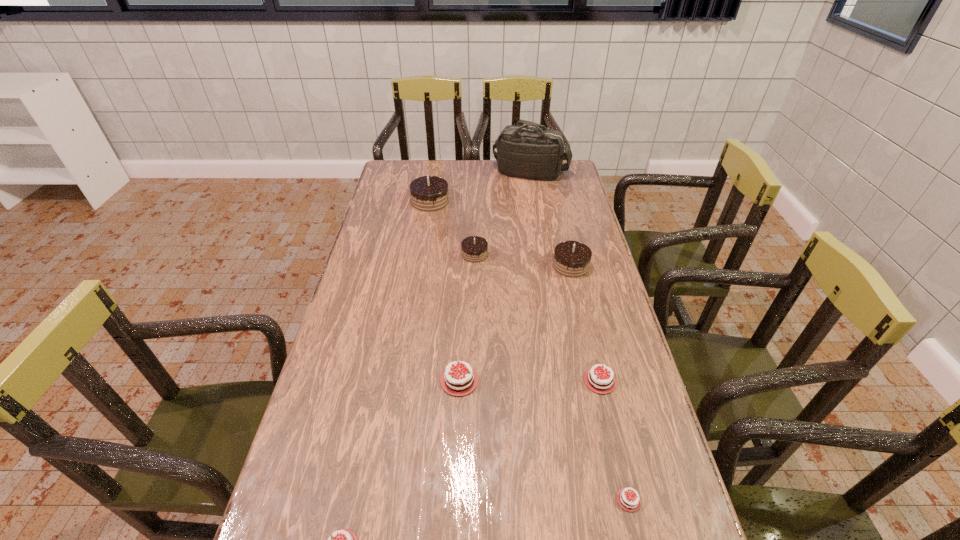
Where is `chocolate chocolate cake that is the nearest to the tallest chocolate cake`? This screenshot has height=540, width=960. chocolate chocolate cake that is the nearest to the tallest chocolate cake is located at coordinates (474, 248).

Locate an element on the screen. The image size is (960, 540). red chocolate cake that can be found as the second closest to the fifth shortest chocolate cake is located at coordinates (602, 382).

Choose which red chocolate cake is the second nearest neighbor to the second shortest object. Please provide its 2D coordinates. Your answer should be formatted as a tuple, i.e. [(x, y)], where the tuple contains the x and y coordinates of a point satisfying the conditions above.

[(628, 500)]

Locate an element on the screen. free location that satisfies the following two spatial constraints: 1. on the front side of the second tallest object; 2. on the left side of the second biggest chocolate chocolate cake is located at coordinates (420, 265).

Locate an element on the screen. free space that satisfies the following two spatial constraints: 1. at the front padded panel of the smallest red chocolate cake; 2. on the left side of the farthest object is located at coordinates (588, 500).

At what (x,y) coordinates should I click in order to perform the action: click on free space that satisfies the following two spatial constraints: 1. on the front side of the second smallest chocolate chocolate cake; 2. on the left side of the third shortest chocolate cake. Please return your answer as a coordinate pair (x, y). Looking at the image, I should click on (598, 381).